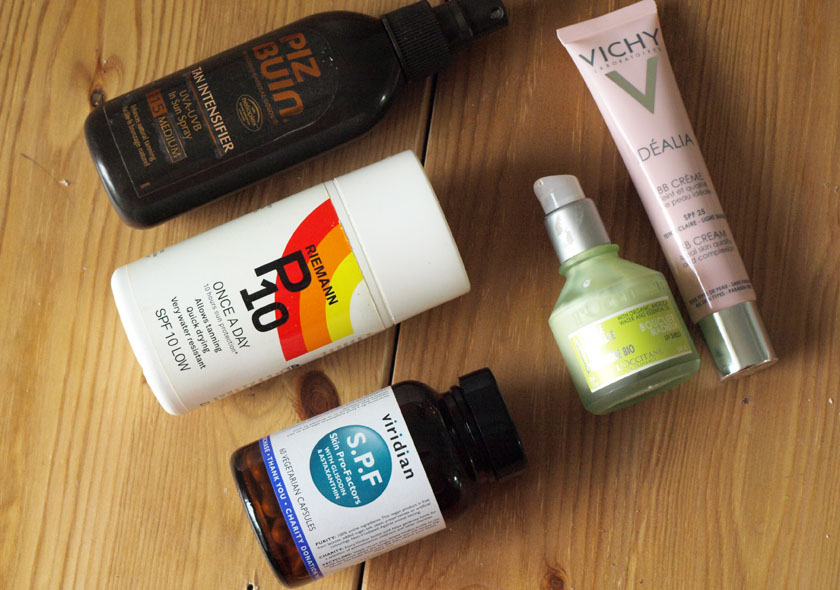
Where is `1 left wooden plank`? 1 left wooden plank is located at coordinates (144, 514).